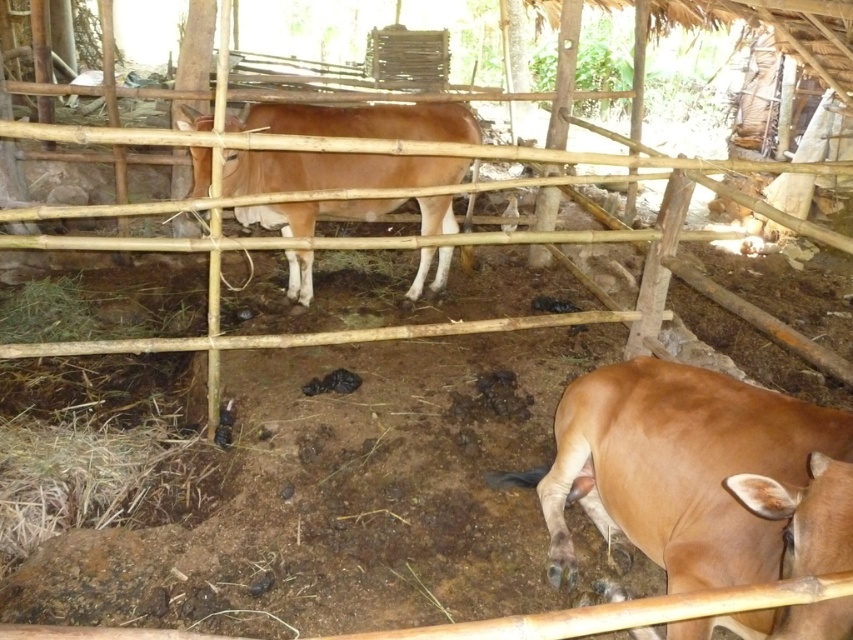
Question: Which point is closer to the camera?

Choices:
 (A) (463, 120)
 (B) (670, 584)

Answer: (B)

Question: Which of the following is the farthest from the observer?

Choices:
 (A) brown matte cow at center
 (B) brown matte cow at lower right

Answer: (A)

Question: Can you confirm if brown matte cow at lower right is positioned to the right of brown matte cow at center?

Choices:
 (A) yes
 (B) no

Answer: (A)

Question: Does brown matte cow at lower right have a larger size compared to brown matte cow at center?

Choices:
 (A) no
 (B) yes

Answer: (A)

Question: Does brown matte cow at lower right have a larger size compared to brown matte cow at center?

Choices:
 (A) no
 (B) yes

Answer: (A)